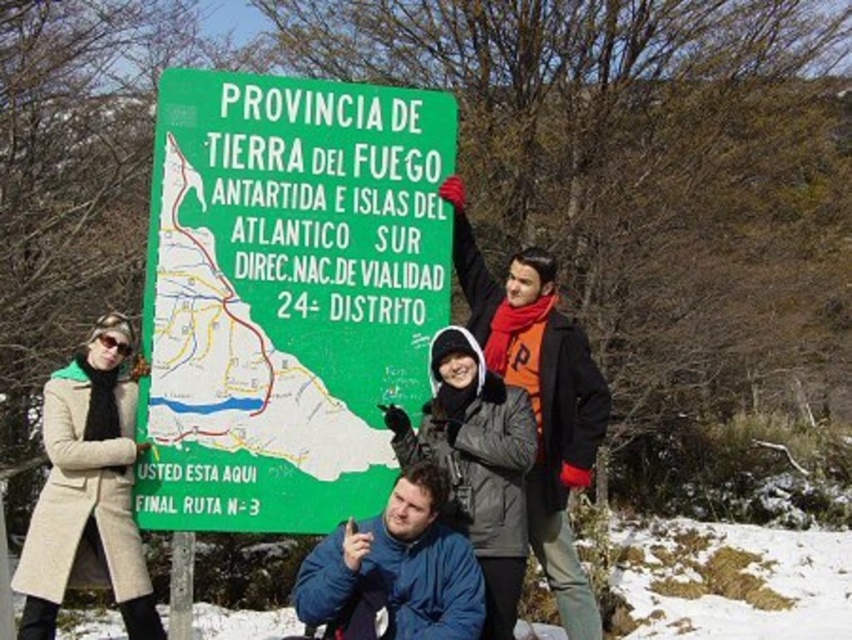
Is dark blue jacket at center positioned before blue fleece jacket at lower center?

No.

Between dark blue jacket at center and blue fleece jacket at lower center, which one has less height?

blue fleece jacket at lower center is shorter.

The width and height of the screenshot is (852, 640). In order to click on dark blue jacket at center in this screenshot , I will do `click(476, 461)`.

Identify the location of beige wool coat at left. (87, 492).

Is beige wool coat at left bigger than dark blue jacket at center?

Correct, beige wool coat at left is larger in size than dark blue jacket at center.

Image resolution: width=852 pixels, height=640 pixels. What do you see at coordinates (87, 492) in the screenshot?
I see `beige wool coat at left` at bounding box center [87, 492].

Where is `beige wool coat at left`? beige wool coat at left is located at coordinates (87, 492).

Does point (114, 534) come farther from viewer compared to point (383, 608)?

Yes, it is behind point (383, 608).

Between beige wool coat at left and blue fleece jacket at lower center, which one has more height?

beige wool coat at left

Is point (98, 333) behind point (302, 579)?

Yes, point (98, 333) is behind point (302, 579).

You are a GUI agent. You are given a task and a screenshot of the screen. Output one action in this format:
    pyautogui.click(x=<x>, y=<y>)
    Task: Click on the beige wool coat at left
    This screenshot has height=640, width=852.
    Given the screenshot: What is the action you would take?
    pyautogui.click(x=87, y=492)